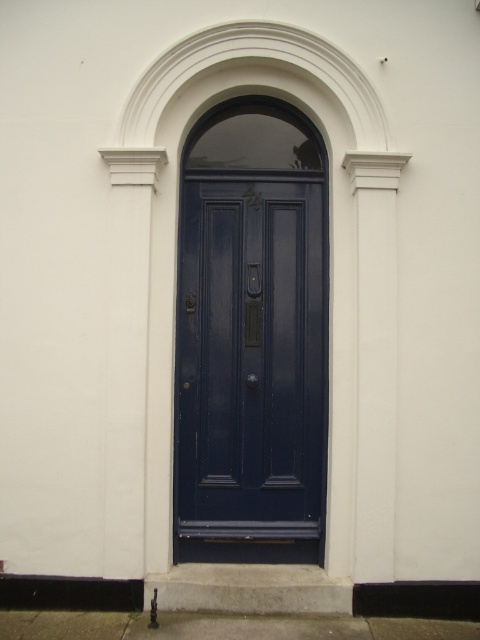
Does glossy wood door at center appear on the right side of white smooth column at right?

No, glossy wood door at center is not to the right of white smooth column at right.

Is point (257, 499) positioned before point (368, 515)?

No, (257, 499) is behind (368, 515).

Find the location of `glossy wood door at center`. glossy wood door at center is located at coordinates (251, 356).